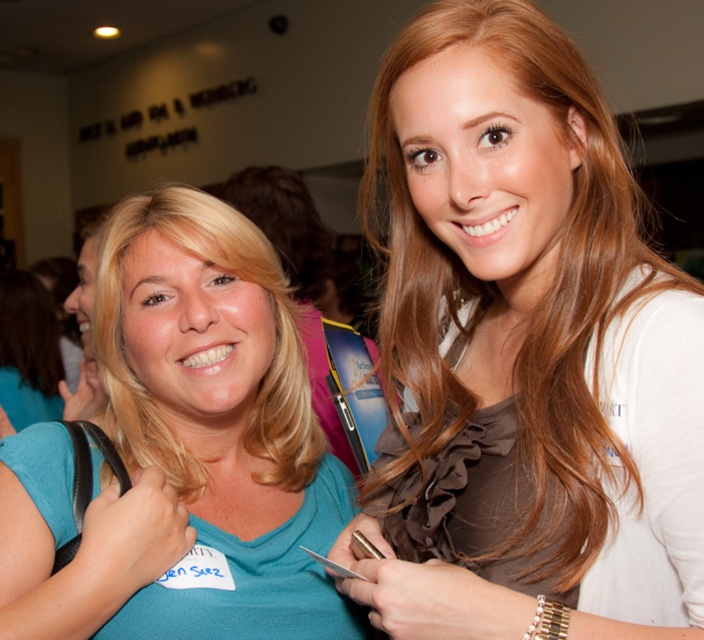
Which is behind, point (194, 620) or point (37, 371)?

Point (37, 371)

How much distance is there between teal matte shirt at center and blonde hair at left?

teal matte shirt at center and blonde hair at left are 2.08 meters apart.

Find the location of a particular element. Image resolution: width=704 pixels, height=640 pixels. teal matte shirt at center is located at coordinates (218, 422).

Between point (616, 289) and point (39, 435), which one is positioned behind?

The point (39, 435) is more distant.

Is matte brown blouse at center shorter than teal matte shirt at center?

No.

Who is more forward, (521, 458) or (287, 532)?

Point (521, 458)

The image size is (704, 640). I want to click on matte brown blouse at center, so click(x=515, y=340).

Between matte brown blouse at center and blonde hair at left, which one has less height?

Standing shorter between the two is matte brown blouse at center.

Which is below, matte brown blouse at center or blonde hair at left?

blonde hair at left is lower down.

Describe the element at coordinates (515, 340) in the screenshot. The height and width of the screenshot is (640, 704). I see `matte brown blouse at center` at that location.

Where is `matte brown blouse at center`? matte brown blouse at center is located at coordinates (515, 340).